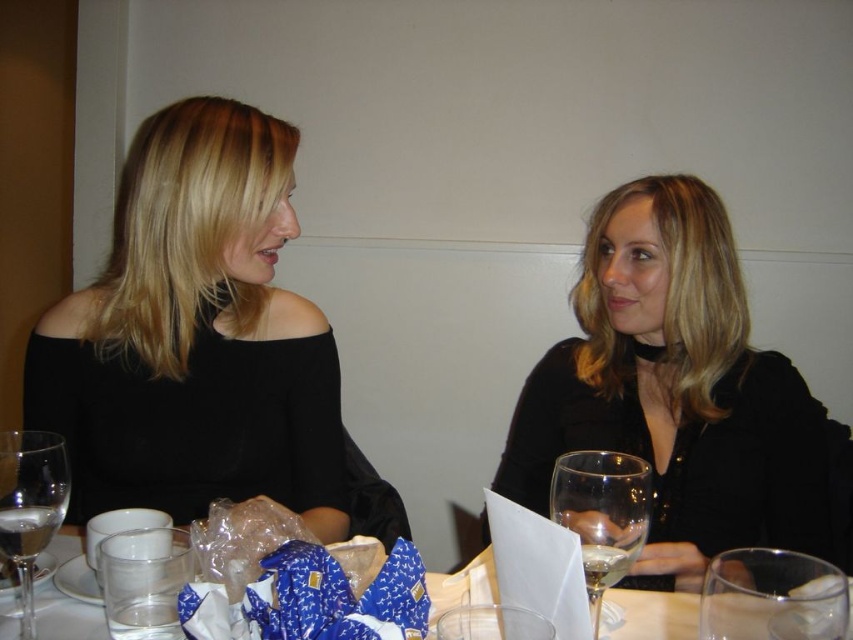
Does transparent glass at lower right have a greater width compared to transparent glass at center?

No, transparent glass at lower right is not wider than transparent glass at center.

Is transparent glass at lower right above transparent glass at center?

Yes.

Image resolution: width=853 pixels, height=640 pixels. Describe the element at coordinates (772, 596) in the screenshot. I see `transparent glass at lower right` at that location.

Where is `transparent glass at lower right`? This screenshot has height=640, width=853. transparent glass at lower right is located at coordinates (772, 596).

What are the coordinates of `black matte off-shoulder top at left` in the screenshot? It's located at pos(195,336).

Is black matte off-shoulder top at left to the left of clear glass water at lower center from the viewer's perspective?

Indeed, black matte off-shoulder top at left is positioned on the left side of clear glass water at lower center.

The width and height of the screenshot is (853, 640). Identify the location of black matte off-shoulder top at left. (195, 336).

The image size is (853, 640). I want to click on black matte off-shoulder top at left, so click(195, 336).

Does black matte off-shoulder top at left appear on the right side of clear glass wine glass at center?

No, black matte off-shoulder top at left is not to the right of clear glass wine glass at center.

Who is lower down, black matte off-shoulder top at left or clear glass wine glass at center?

Positioned lower is clear glass wine glass at center.

Does point (230, 268) lie in front of point (643, 464)?

No, (230, 268) is further to viewer.

I want to click on black matte off-shoulder top at left, so click(x=195, y=336).